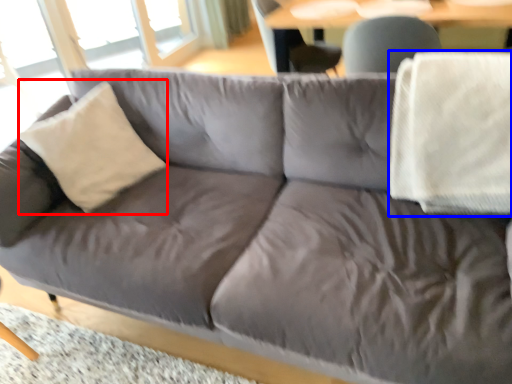
Question: Which object is further to the camera taking this photo, throw pillow (highlighted by a red box) or blanket (highlighted by a blue box)?

Choices:
 (A) throw pillow
 (B) blanket

Answer: (A)